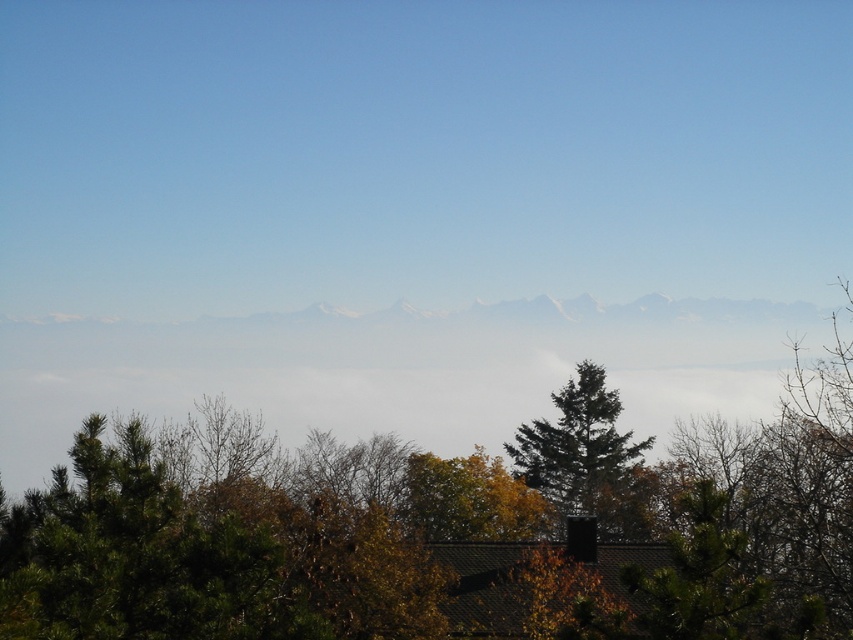
Question: Among these objects, which one is nearest to the camera?

Choices:
 (A) green textured tree at center
 (B) green needle-like tree at center
 (C) yellow-green foliage at center

Answer: (A)

Question: Which object is the closest to the green needle-like tree at center?

Choices:
 (A) yellow-green foliage at center
 (B) green textured tree at center

Answer: (B)

Question: Which point is closer to the camera?

Choices:
 (A) green needle-like tree at center
 (B) green textured tree at center
 (C) yellow-green foliage at center

Answer: (B)

Question: Does green textured tree at center have a greater width compared to green needle-like tree at center?

Choices:
 (A) no
 (B) yes

Answer: (B)

Question: Can you confirm if green needle-like tree at center is wider than yellow-green foliage at center?

Choices:
 (A) no
 (B) yes

Answer: (B)

Question: Does green textured tree at center come behind yellow-green foliage at center?

Choices:
 (A) yes
 (B) no

Answer: (B)